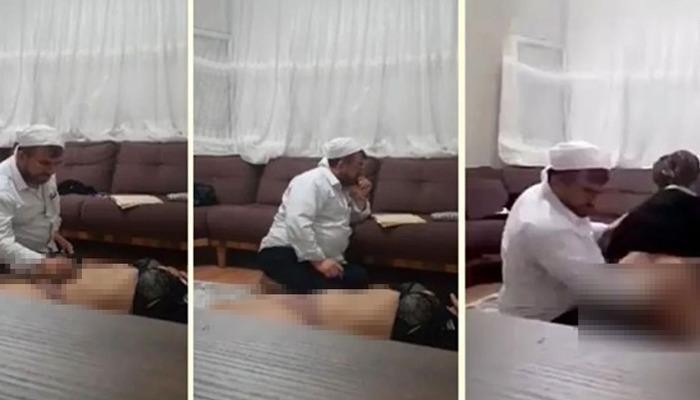
Locate an element on the screen. The image size is (700, 400). picture panel is located at coordinates (103, 118), (335, 121), (538, 127).